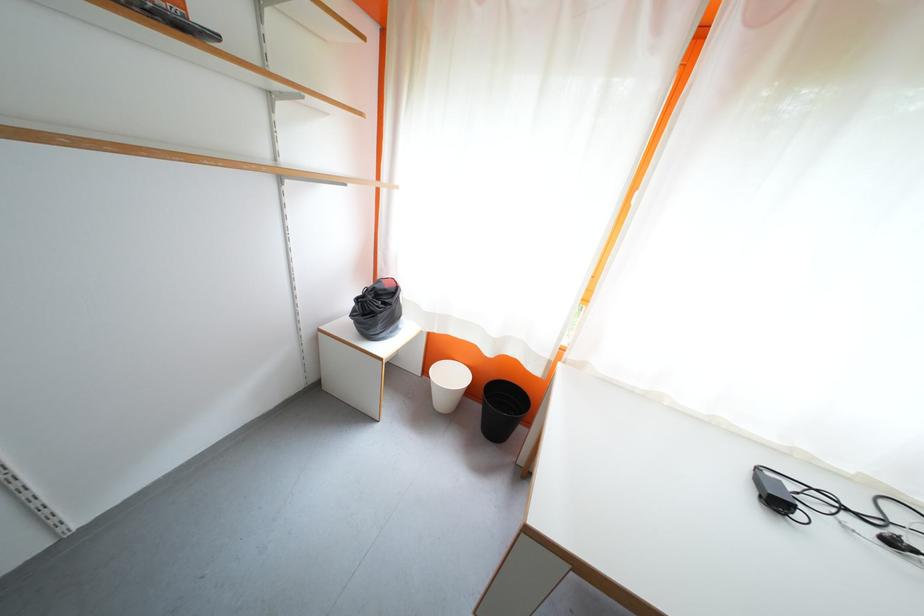
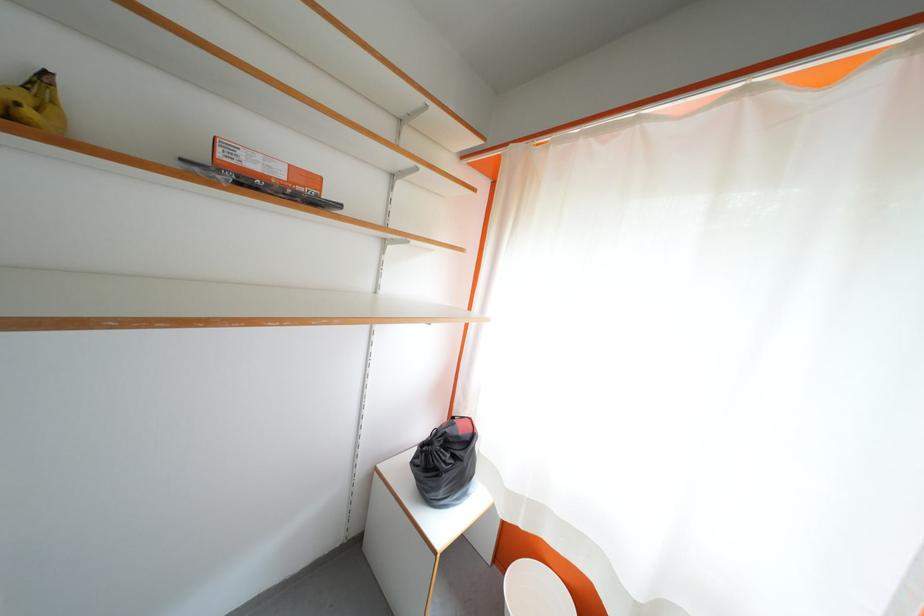
The point at (386, 310) is marked in the first image. Where is the corresponding point in the second image?

(455, 460)